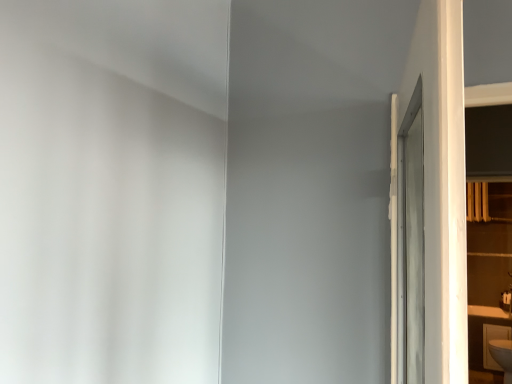
Question: From a real-world perspective, is white glossy sink at lower right positioned above or below white glossy shelf at right?

Choices:
 (A) above
 (B) below

Answer: (B)

Question: Is point (508, 329) positioned closer to the camera than point (508, 289)?

Choices:
 (A) farther
 (B) closer

Answer: (B)

Question: In the image, is white glossy sink at lower right positioned in front of or behind white glossy shelf at right?

Choices:
 (A) behind
 (B) front

Answer: (A)

Question: In terms of width, does white glossy shelf at right look wider or thinner when compared to white glossy sink at lower right?

Choices:
 (A) thin
 (B) wide

Answer: (A)

Question: Does point (486, 248) appear closer or farther from the camera than point (485, 352)?

Choices:
 (A) closer
 (B) farther

Answer: (B)

Question: Based on their sizes in the image, would you say white glossy shelf at right is bigger or smaller than white glossy sink at lower right?

Choices:
 (A) small
 (B) big

Answer: (B)

Question: From the image's perspective, is white glossy shelf at right above or below white glossy sink at lower right?

Choices:
 (A) below
 (B) above

Answer: (B)